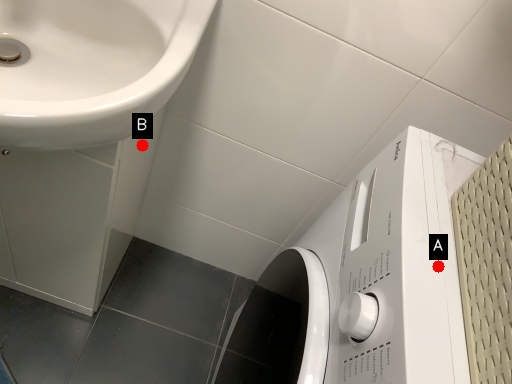
Question: Two points are circled on the image, labeled by A and B beside each circle. Which point is farther to the camera?

Choices:
 (A) A is further
 (B) B is further

Answer: (B)